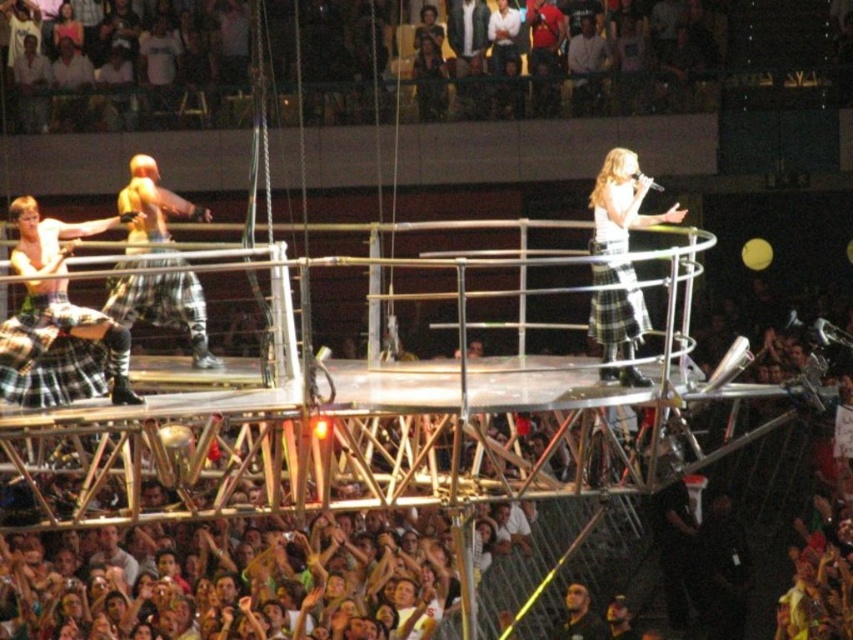
Question: Which of the following is the closest to the observer?

Choices:
 (A) matte plaid kilt at center
 (B) plaid skirt at center

Answer: (A)

Question: Does plaid skirt at center have a smaller size compared to dark brown leather jacket at lower center?

Choices:
 (A) yes
 (B) no

Answer: (B)

Question: Which of the following is the farthest from the observer?

Choices:
 (A) dark brown leather jacket at lower center
 (B) matte plaid kilt at center
 (C) plaid skirt at center

Answer: (A)

Question: Which object is positioned farthest from the matte plaid kilt at center?

Choices:
 (A) plaid skirt at center
 (B) dark brown leather jacket at lower center

Answer: (B)

Question: Is matte plaid kilt at center wider than dark brown leather jacket at lower center?

Choices:
 (A) no
 (B) yes

Answer: (B)

Question: Where is plaid skirt at center located in relation to dark brown leather jacket at lower center in the image?

Choices:
 (A) right
 (B) left

Answer: (A)